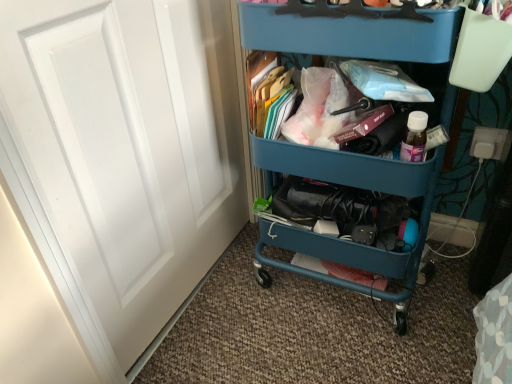
Question: Can you confirm if teal plastic cart at center is smaller than white matte door at left?

Choices:
 (A) yes
 (B) no

Answer: (B)

Question: Is teal plastic cart at center aimed at white matte door at left?

Choices:
 (A) no
 (B) yes

Answer: (A)

Question: Can we say teal plastic cart at center lies outside white matte door at left?

Choices:
 (A) yes
 (B) no

Answer: (A)

Question: Is teal plastic cart at center in contact with white matte door at left?

Choices:
 (A) yes
 (B) no

Answer: (B)

Question: From the image's perspective, does teal plastic cart at center appear higher than white matte door at left?

Choices:
 (A) yes
 (B) no

Answer: (A)

Question: Considering the positions of white matte door at left and blue plastic cart at upper center in the image, is white matte door at left taller or shorter than blue plastic cart at upper center?

Choices:
 (A) tall
 (B) short

Answer: (A)

Question: From the image's perspective, is white matte door at left positioned above or below blue plastic cart at upper center?

Choices:
 (A) above
 (B) below

Answer: (B)

Question: Considering the positions of point tap(84, 99) and point tap(352, 145), is point tap(84, 99) closer or farther from the camera than point tap(352, 145)?

Choices:
 (A) farther
 (B) closer

Answer: (B)

Question: Which is correct: white matte door at left is inside blue plastic cart at upper center, or outside of it?

Choices:
 (A) outside
 (B) inside

Answer: (A)

Question: Considering the positions of teal plastic cart at center and white matte door at left in the image, is teal plastic cart at center bigger or smaller than white matte door at left?

Choices:
 (A) big
 (B) small

Answer: (A)

Question: Is point (390, 18) closer or farther from the camera than point (206, 240)?

Choices:
 (A) closer
 (B) farther

Answer: (A)

Question: From the image's perspective, is teal plastic cart at center above or below white matte door at left?

Choices:
 (A) above
 (B) below

Answer: (A)

Question: Looking at their shapes, would you say teal plastic cart at center is wider or thinner than white matte door at left?

Choices:
 (A) wide
 (B) thin

Answer: (A)

Question: Do you think teal plastic cart at center is within blue plastic cart at upper center, or outside of it?

Choices:
 (A) inside
 (B) outside

Answer: (B)

Question: From the image's perspective, is teal plastic cart at center located above or below blue plastic cart at upper center?

Choices:
 (A) above
 (B) below

Answer: (B)